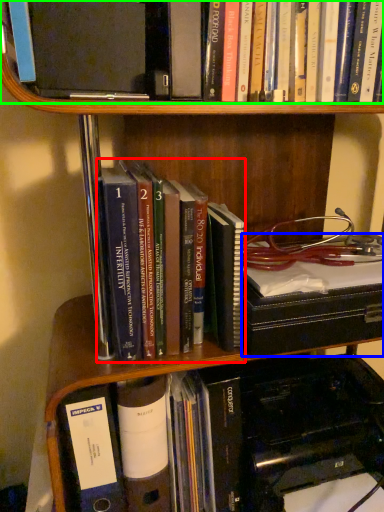
Question: Estimate the real-world distances between objects in this image. Which object is closer to book (highlighted by a red box), book (highlighted by a blue box) or book (highlighted by a green box)?

Choices:
 (A) book
 (B) book

Answer: (A)